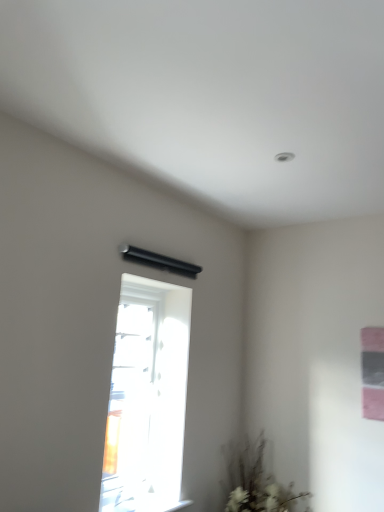
Question: Would you say transparent glass window at center is to the left or to the right of white matte plant at lower right in the picture?

Choices:
 (A) left
 (B) right

Answer: (A)

Question: Considering the positions of transparent glass window at center and white matte plant at lower right in the image, is transparent glass window at center wider or thinner than white matte plant at lower right?

Choices:
 (A) thin
 (B) wide

Answer: (A)

Question: From a real-world perspective, is transparent glass window at center above or below white matte plant at lower right?

Choices:
 (A) below
 (B) above

Answer: (B)

Question: In terms of size, does white matte plant at lower right appear bigger or smaller than transparent glass window at center?

Choices:
 (A) big
 (B) small

Answer: (B)

Question: Is white matte plant at lower right taller or shorter than transparent glass window at center?

Choices:
 (A) short
 (B) tall

Answer: (A)

Question: From the image's perspective, is white matte plant at lower right above or below transparent glass window at center?

Choices:
 (A) above
 (B) below

Answer: (B)

Question: Does point (241, 502) appear closer or farther from the camera than point (117, 404)?

Choices:
 (A) closer
 (B) farther

Answer: (A)